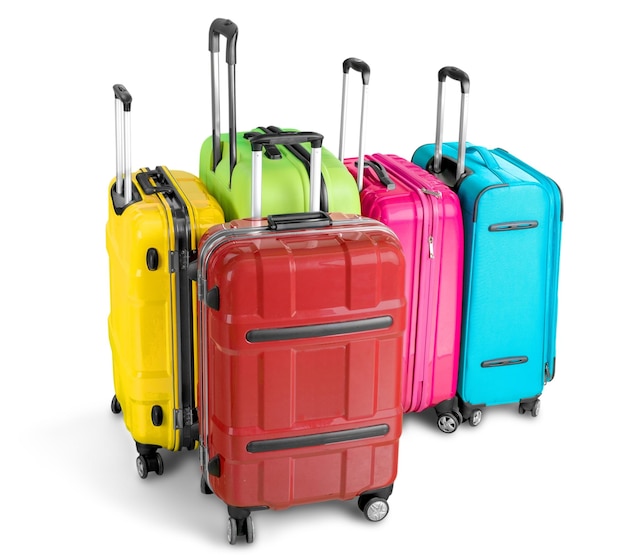
Where is `handles`? This screenshot has width=626, height=555. handles is located at coordinates (294, 211), (148, 178), (269, 149), (372, 165), (490, 156).